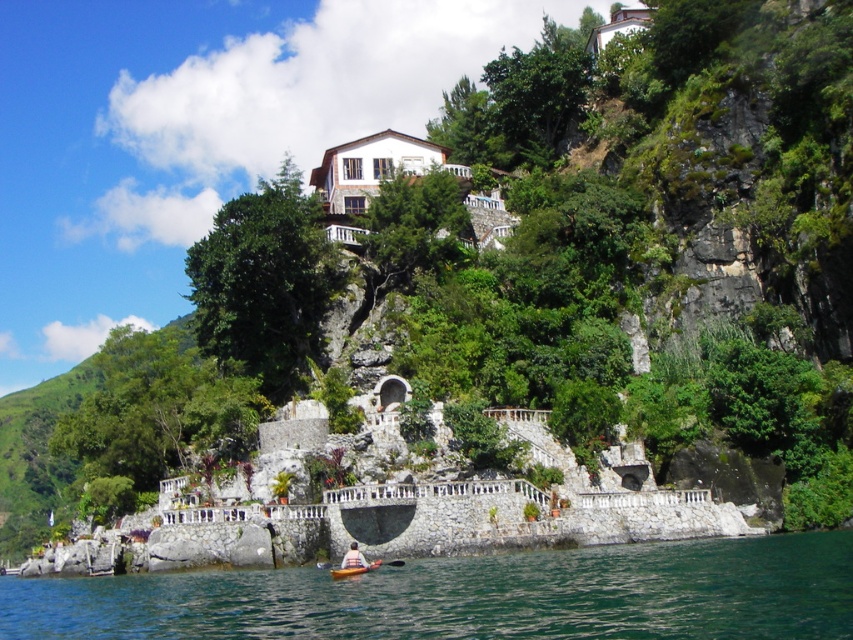
Who is positioned more to the left, green water at lower center or white fabric kayak at lower center?

white fabric kayak at lower center is more to the left.

Does point (26, 596) come closer to viewer compared to point (350, 544)?

That is False.

Identify the location of green water at lower center. [473, 595].

Find the location of a particular element. This screenshot has height=640, width=853. green water at lower center is located at coordinates (473, 595).

Between point (346, 573) and point (361, 563), which one is positioned behind?

Point (361, 563)

Can you confirm if matte yellow kayak at lower center is wider than white fabric kayak at lower center?

Yes, matte yellow kayak at lower center is wider than white fabric kayak at lower center.

Image resolution: width=853 pixels, height=640 pixels. What do you see at coordinates (354, 570) in the screenshot? I see `matte yellow kayak at lower center` at bounding box center [354, 570].

Find the location of a particular element. matte yellow kayak at lower center is located at coordinates (354, 570).

Is green water at lower center to the right of matte yellow kayak at lower center from the viewer's perspective?

In fact, green water at lower center is to the left of matte yellow kayak at lower center.

Which is behind, point (741, 577) or point (341, 572)?

Positioned behind is point (341, 572).

This screenshot has height=640, width=853. Find the location of `green water at lower center`. green water at lower center is located at coordinates (473, 595).